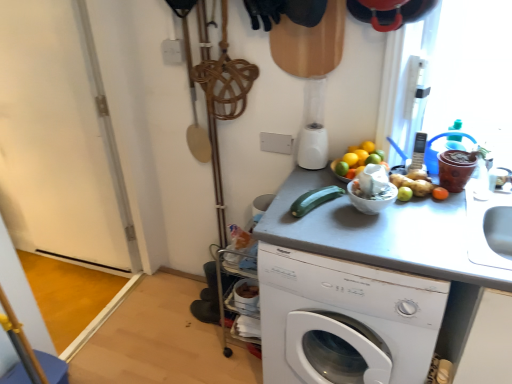
At what (x,y) coordinates should I click in order to perform the action: click on free space to the left of orange matte at upper right. Please return your answer as a coordinate pair (x, y). Image resolution: width=512 pixels, height=384 pixels. Looking at the image, I should click on (319, 181).